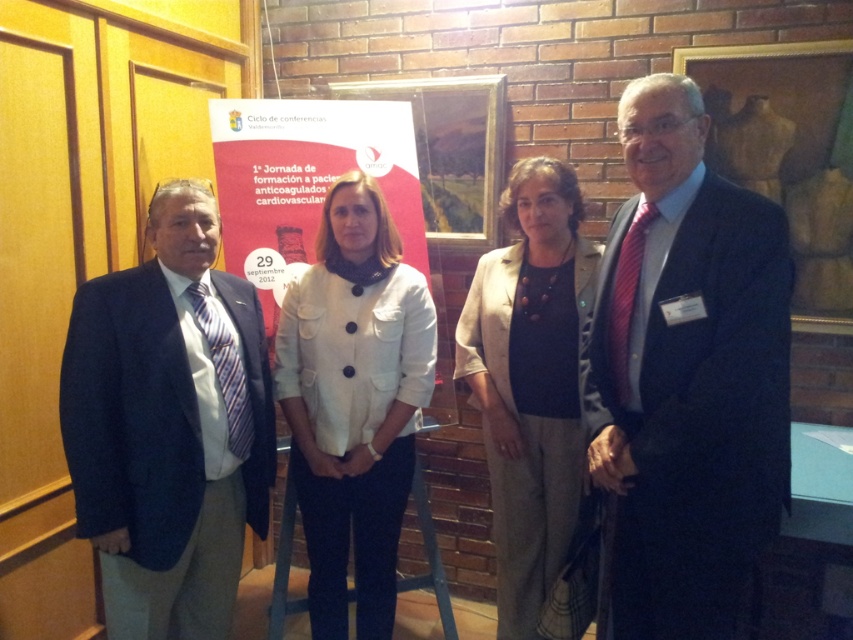
Question: Can you confirm if white matte jacket at center is positioned to the right of matte red poster at center?

Choices:
 (A) no
 (B) yes

Answer: (B)

Question: Is dark blue suit at center smaller than beige textured blazer at center?

Choices:
 (A) no
 (B) yes

Answer: (B)

Question: Which object is the closest to the dark blue suit at center?

Choices:
 (A) beige textured blazer at center
 (B) blue suit at left

Answer: (A)

Question: Which point is closer to the camera?

Choices:
 (A) white matte jacket at center
 (B) blue suit at left

Answer: (B)

Question: Is dark blue suit at center in front of beige textured blazer at center?

Choices:
 (A) yes
 (B) no

Answer: (A)

Question: Which of the following is the farthest from the observer?

Choices:
 (A) dark blue suit at center
 (B) white matte jacket at center

Answer: (B)